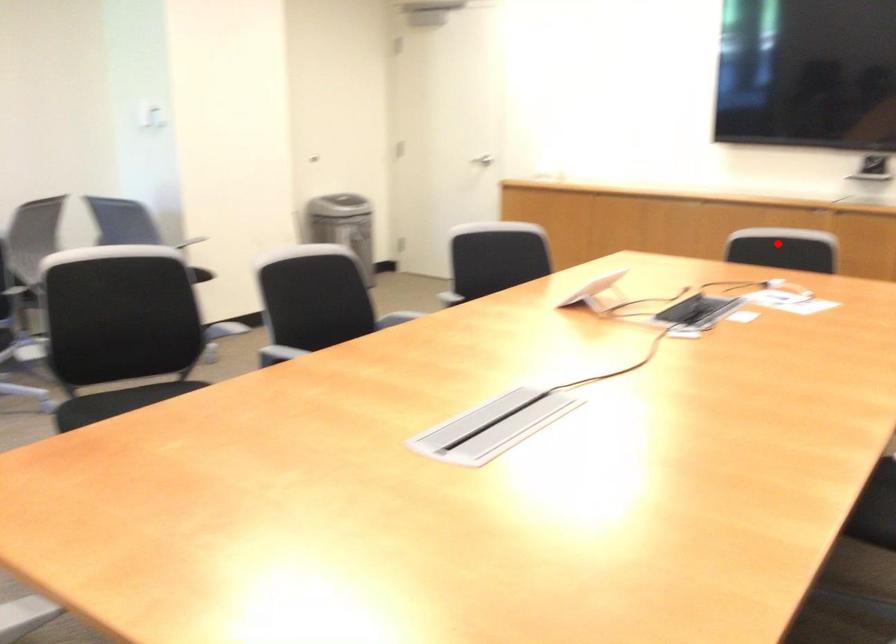
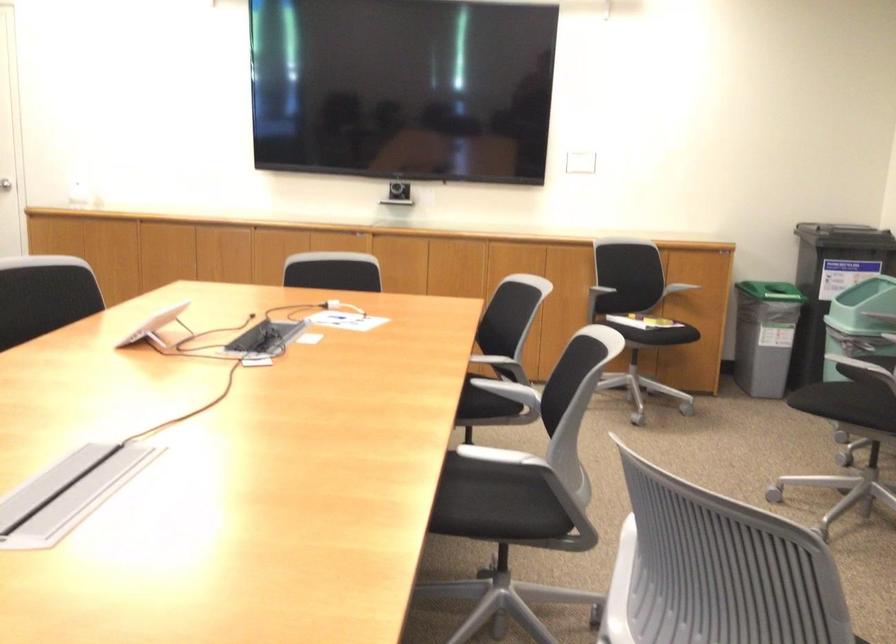
Question: A red point is marked in image1. In image2, is the corresponding 3D point closer to the camera or farther? Reply with the corresponding letter.

Choices:
 (A) The corresponding 3D point is closer.
 (B) The corresponding 3D point is farther.

Answer: (B)